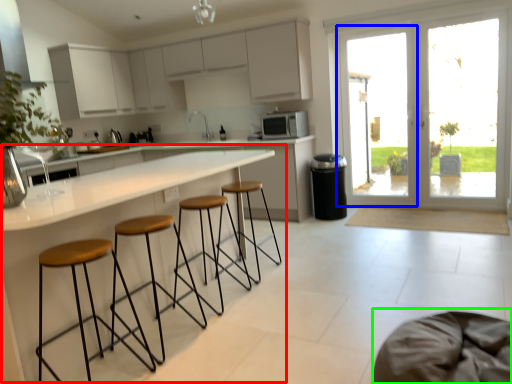
Question: Estimate the real-world distances between objects in this image. Which object is farther from round table (highlighted by a red box), screen door (highlighted by a blue box) or swivel chair (highlighted by a green box)?

Choices:
 (A) screen door
 (B) swivel chair

Answer: (A)